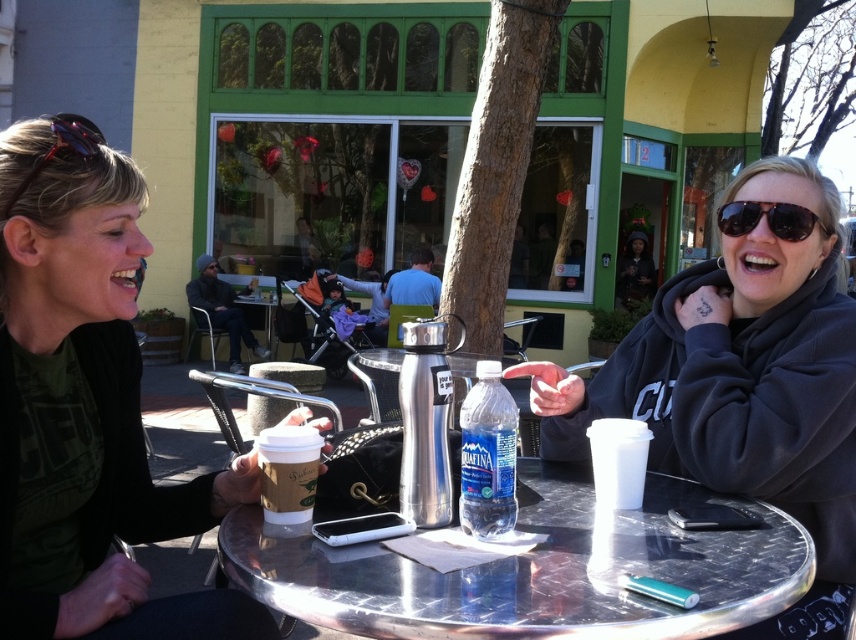
Question: Is metallic silver table at center positioned before clear plastic bottle at center?

Choices:
 (A) no
 (B) yes

Answer: (B)

Question: Is matte black hoodie at center above metallic silver table at center?

Choices:
 (A) no
 (B) yes

Answer: (B)

Question: Which point is farther from the camera taking this photo?

Choices:
 (A) (282, 605)
 (B) (94, 404)
 (C) (752, 204)

Answer: (C)

Question: Which point appears closest to the camera in this image?

Choices:
 (A) (108, 257)
 (B) (651, 632)
 (C) (306, 508)
 (D) (551, 413)

Answer: (B)

Question: Among these objects, which one is farthest from the camera?

Choices:
 (A) metallic silver table at center
 (B) matte black hoodie at center

Answer: (B)

Question: Does clear plastic bottle at center have a larger size compared to matte paper cup at center?

Choices:
 (A) no
 (B) yes

Answer: (A)